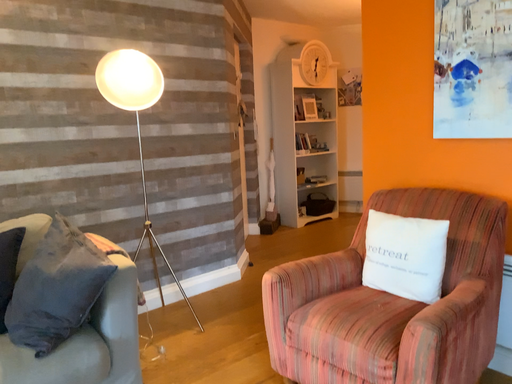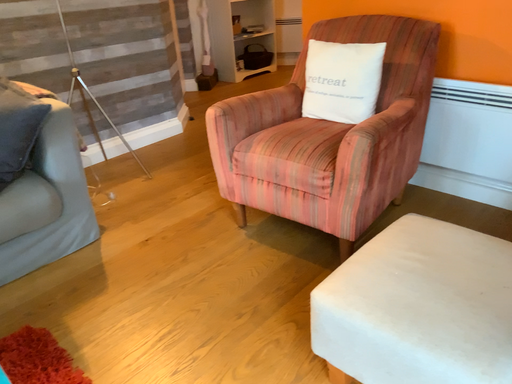
Question: How did the camera likely rotate when shooting the video?

Choices:
 (A) rotated left
 (B) rotated right

Answer: (B)